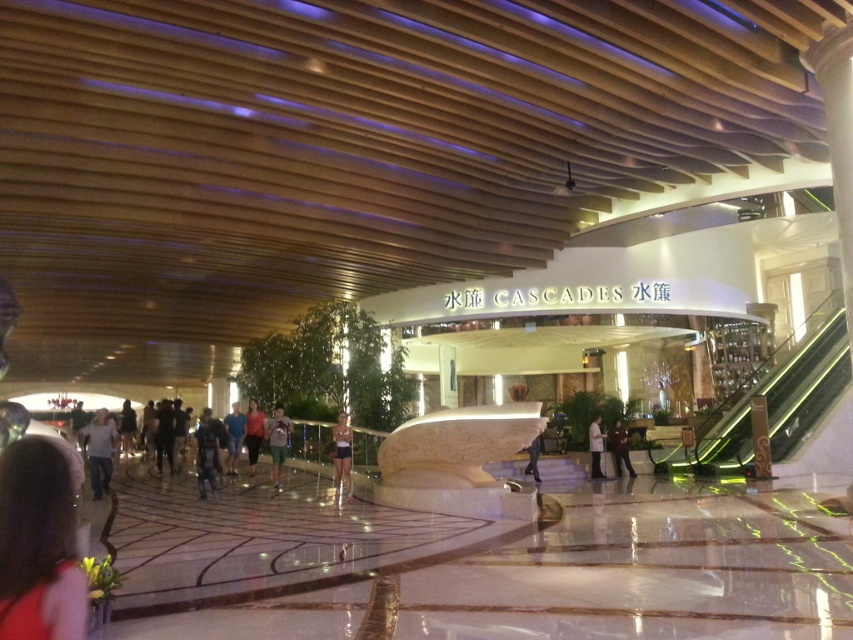
You are a photographer standing in the atrium and want to capture both the dark blue fabric jacket at center and the dark blue jeans at center in a single frame. Which object should you focus on first to ensure both are in the frame?

The dark blue fabric jacket at center is bigger than the dark blue jeans at center, so you should focus on the dark blue fabric jacket at center first to ensure both are in the frame.

You are a customer in the atrium and want to locate both the light brown shorts at center and the dark brown leather jacket at center. According to the scene, which one is positioned to the left of the other?

The light brown shorts at center is positioned on the left side of dark brown leather jacket at center.